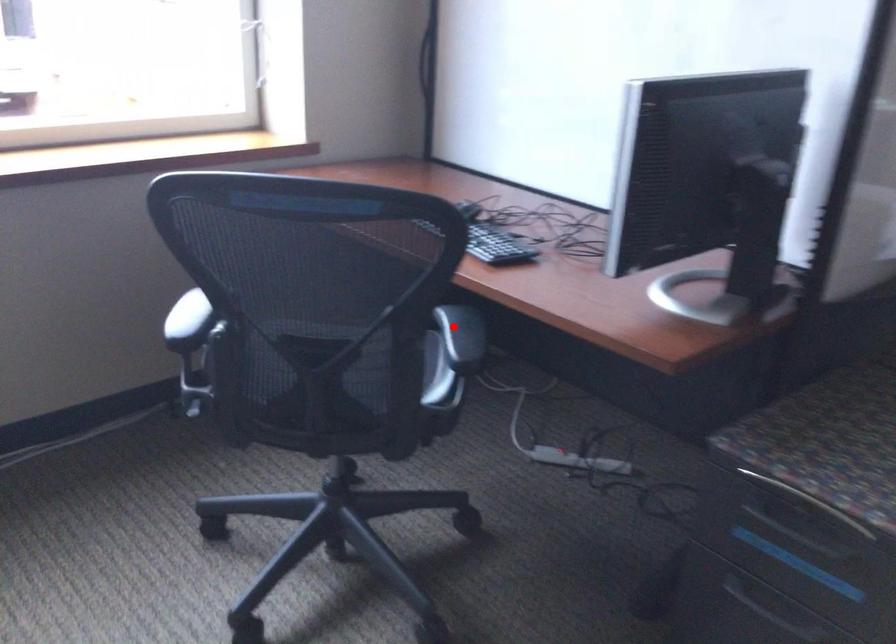
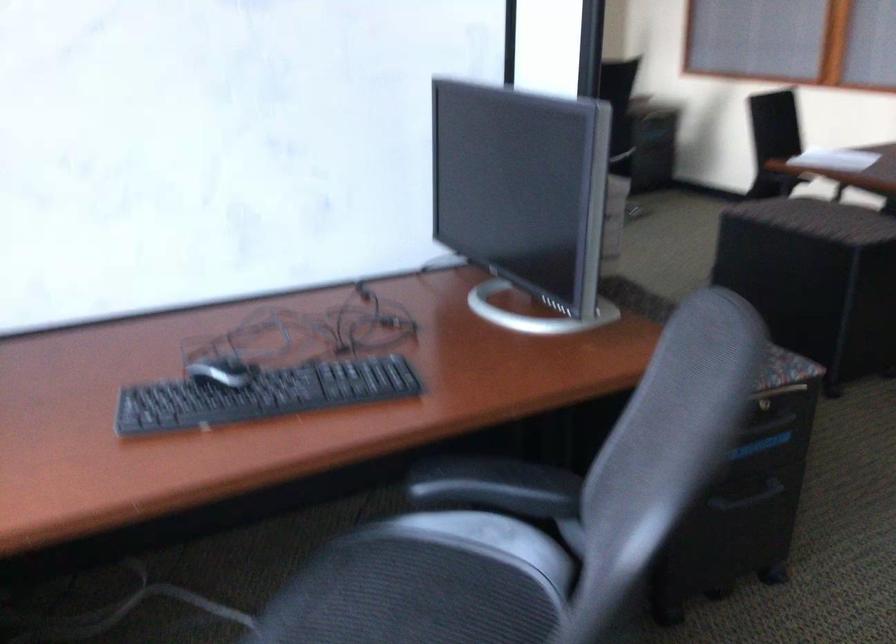
Question: A red point is marked in image1. In image2, is the corresponding 3D point closer to the camera or farther? Reply with the corresponding letter.

Choices:
 (A) The corresponding 3D point is closer.
 (B) The corresponding 3D point is farther.

Answer: (A)